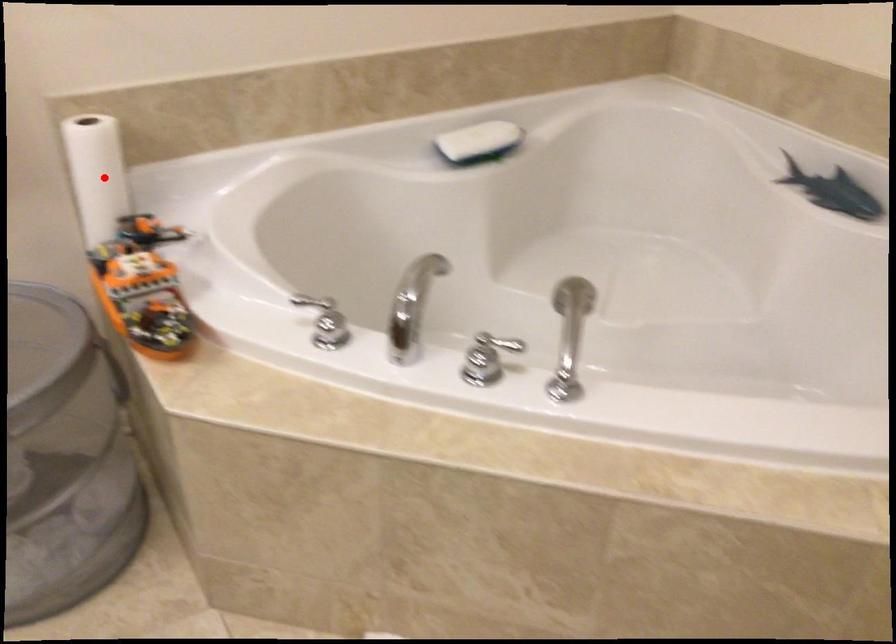
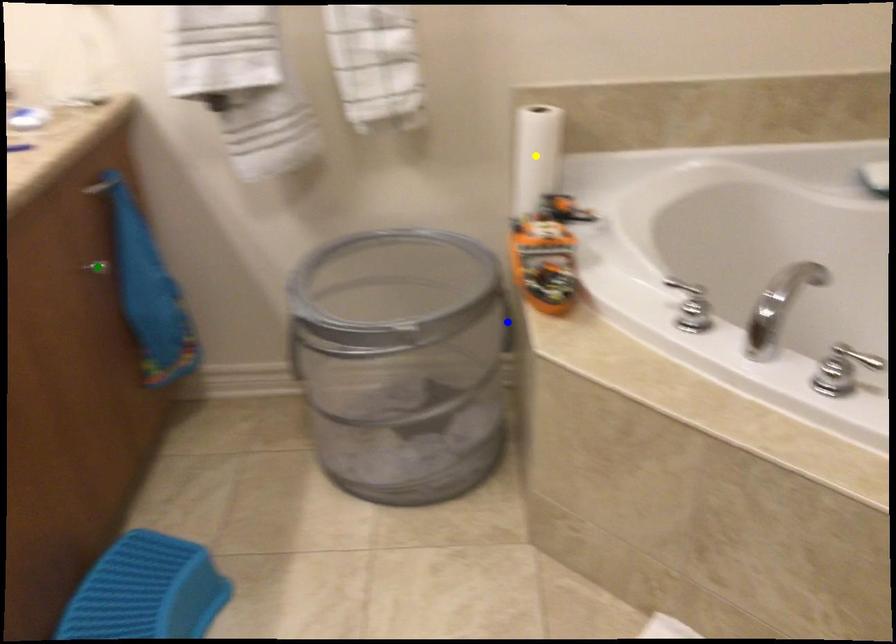
Question: I am providing you with two images of the same scene from different viewpoints. A red point is marked on the first image. You are given multiple points on the second image. Which point in image 2 is actually the same real-world point as the red point in image 1?

Choices:
 (A) green point
 (B) yellow point
 (C) blue point

Answer: (B)